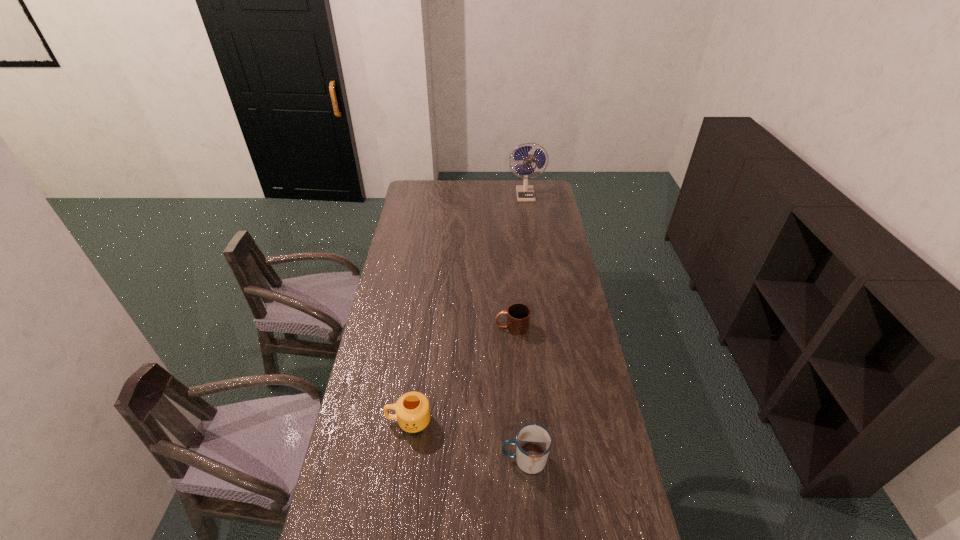
The image size is (960, 540). I want to click on fan, so click(x=524, y=193).

You are a GUI agent. You are given a task and a screenshot of the screen. Output one action in this format:
    pyautogui.click(x=<x>, y=<y>)
    Task: Click on the tallest object
    
    Given the screenshot: What is the action you would take?
    pyautogui.click(x=524, y=193)

Find the location of a particular element. the nearest object is located at coordinates (533, 442).

At what (x,y) coordinates should I click in order to perform the action: click on the leftmost mug. Please return your answer as a coordinate pair (x, y). The height and width of the screenshot is (540, 960). Looking at the image, I should click on click(412, 409).

What are the coordinates of `the second nearest mug` in the screenshot? It's located at (412, 409).

I want to click on the third nearest object, so click(x=518, y=315).

This screenshot has height=540, width=960. Identify the location of the shortest object. (518, 315).

Identify the location of free region located on the front-facing side of the tallest object. (528, 214).

I want to click on vacant space located 0.190m on the handle side of the nearest object, so click(438, 460).

Where is `vacant position located 0.290m on the handle side of the nearest object`? The height and width of the screenshot is (540, 960). vacant position located 0.290m on the handle side of the nearest object is located at coordinates (405, 460).